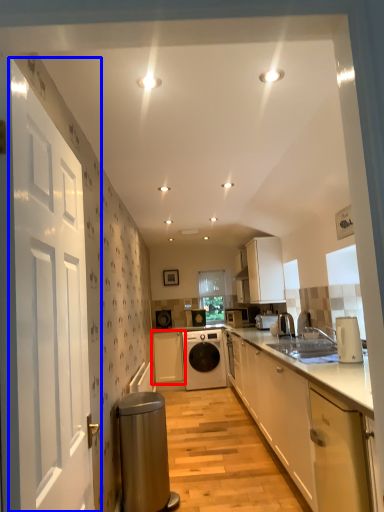
Question: Which object appears farthest to the camera in this image, cabinetry (highlighted by a red box) or door (highlighted by a blue box)?

Choices:
 (A) cabinetry
 (B) door

Answer: (A)